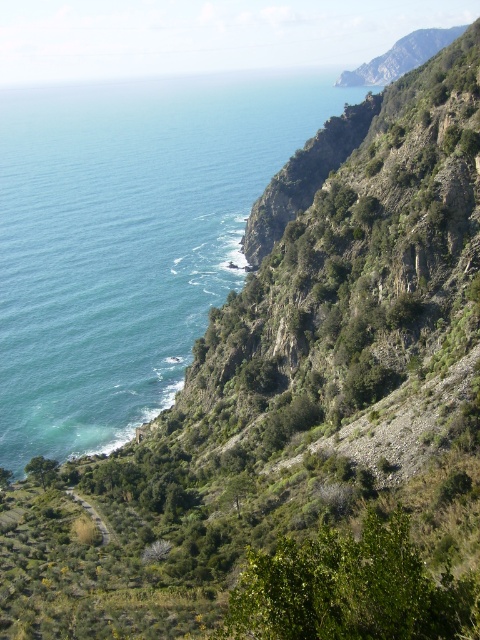
Is point (319, 88) behind point (82, 502)?

Yes, it is behind point (82, 502).

Who is positioned more to the right, blue water at upper left or green grassy path at lower left?

From the viewer's perspective, green grassy path at lower left appears more on the right side.

Who is more forward, (x=13, y=464) or (x=97, y=525)?

Point (x=97, y=525) is in front.

Where is `blue water at upper left`? The width and height of the screenshot is (480, 640). blue water at upper left is located at coordinates click(x=128, y=237).